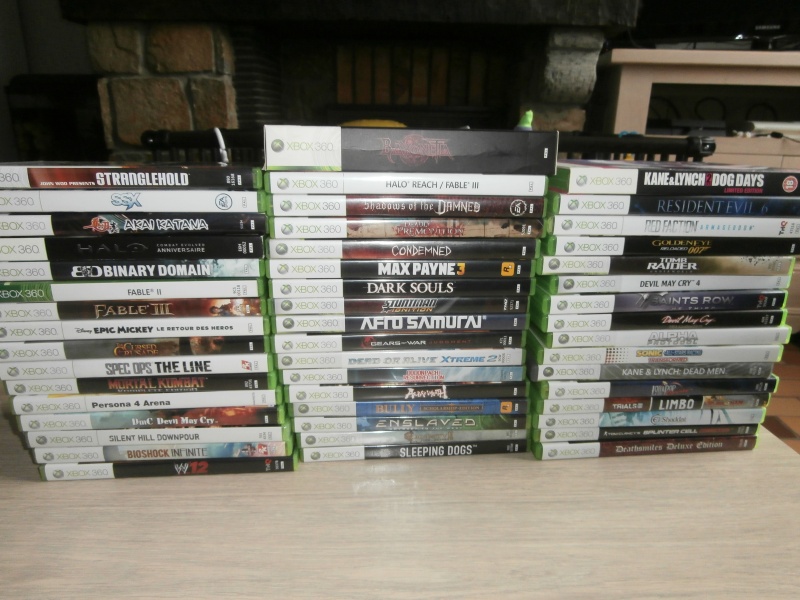
I want to click on red brick back wall, so click(216, 96), click(164, 103), click(102, 97), click(120, 154), click(112, 43), click(168, 43), click(222, 52).